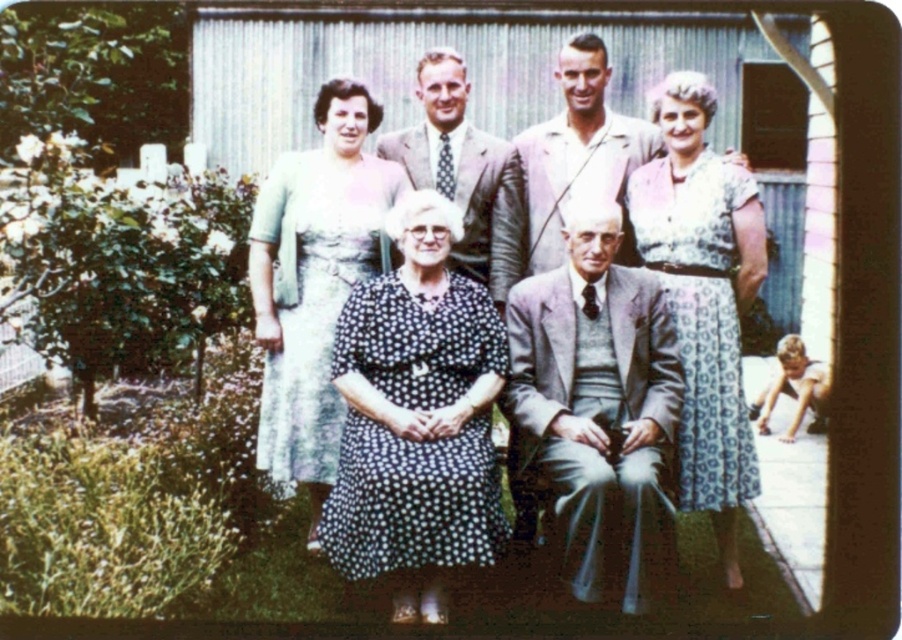
You are a photographer trying to adjust the spacing between the light blue fabric dress at upper left and the printed cotton dress at center for a better composition. The current distance between them is 6.33 feet. If you want to reduce the distance by half, what should the new distance be?

The current distance between the light blue fabric dress at upper left and the printed cotton dress at center is 6.33 feet. Reducing it by half would make the new distance approximately 3.165 feet.

Based on the scene description and the objects provided, can you identify the object located at the coordinates point (416, 419)?

The point (416, 419) indicates the black dotted dress at center.

You are a photographer setting up for a group photo. You have two subjects wearing the black dotted dress at center and the light gray suit at center. You need to ensure that the wider subject is placed in the center for better balance. Which subject should you position centrally?

The black dotted dress at center is wider than the light gray suit at center, so you should position the black dotted dress at center in the center for better balance.